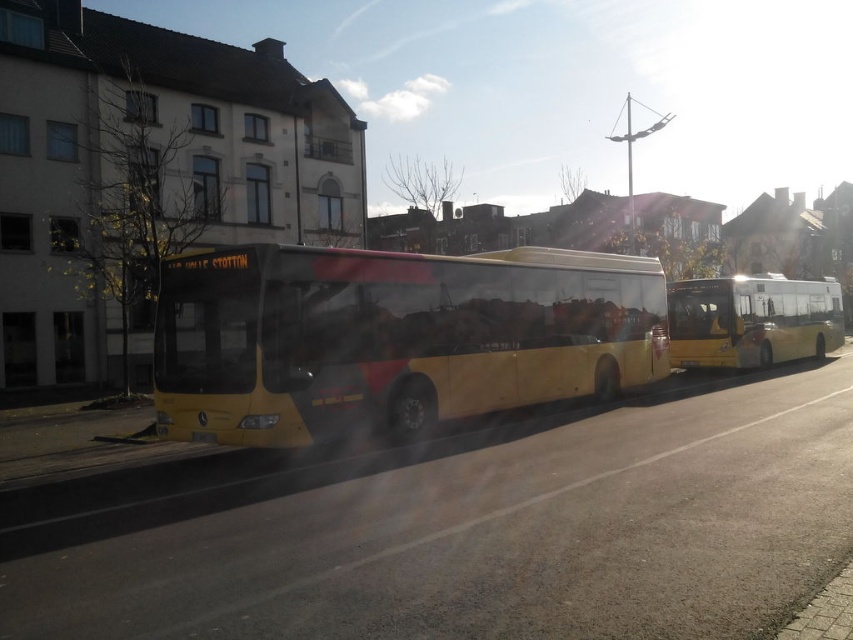
Question: Is yellow matte bus at center further to the viewer compared to yellow metallic bus at right?

Choices:
 (A) no
 (B) yes

Answer: (A)

Question: Which point is farther from the camera taking this photo?

Choices:
 (A) (793, 314)
 (B) (158, 403)

Answer: (A)

Question: Is yellow matte bus at center smaller than yellow metallic bus at right?

Choices:
 (A) no
 (B) yes

Answer: (B)

Question: Where is yellow matte bus at center located in relation to yellow metallic bus at right in the image?

Choices:
 (A) right
 (B) left

Answer: (B)

Question: Which object appears farthest from the camera in this image?

Choices:
 (A) yellow metallic bus at right
 (B) yellow matte bus at center

Answer: (A)